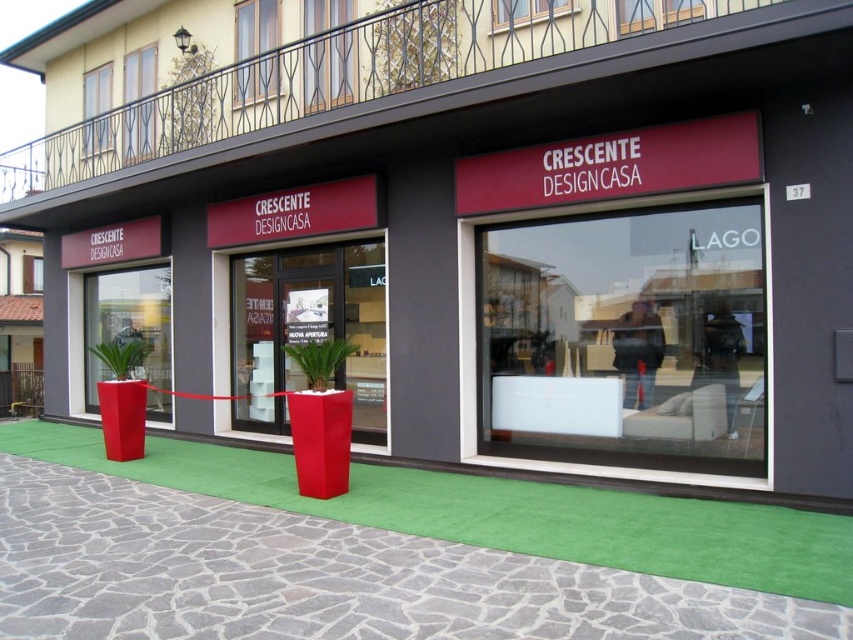
Which of these two, transparent glass window at center or matte red planter at center left, stands taller?

matte red planter at center left

Does transparent glass window at center appear on the left side of matte red planter at center left?

Incorrect, transparent glass window at center is not on the left side of matte red planter at center left.

Who is more distant from viewer, (695, 294) or (154, 381)?

Point (154, 381)

The image size is (853, 640). In order to click on transparent glass window at center in this screenshot , I will do [x=625, y=339].

Measure the distance between matte red planter at center and camera.

28.49 feet

How distant is matte red planter at center from matte red planter at center left?

The distance of matte red planter at center from matte red planter at center left is 3.68 meters.

Which is behind, point (300, 376) or point (142, 368)?

Point (142, 368)

At what (x,y) coordinates should I click in order to perform the action: click on matte red planter at center. Please return your answer as a coordinate pair (x, y). Looking at the image, I should click on (312, 321).

Who is shorter, green stone pavement at lower center or matte red planter at center?

green stone pavement at lower center is shorter.

Does point (418, 596) lie behind point (370, 301)?

No.

Does point (296, 557) come behind point (306, 278)?

No, (296, 557) is closer to viewer.

Locate an element on the screen. Image resolution: width=853 pixels, height=640 pixels. green stone pavement at lower center is located at coordinates pos(321,577).